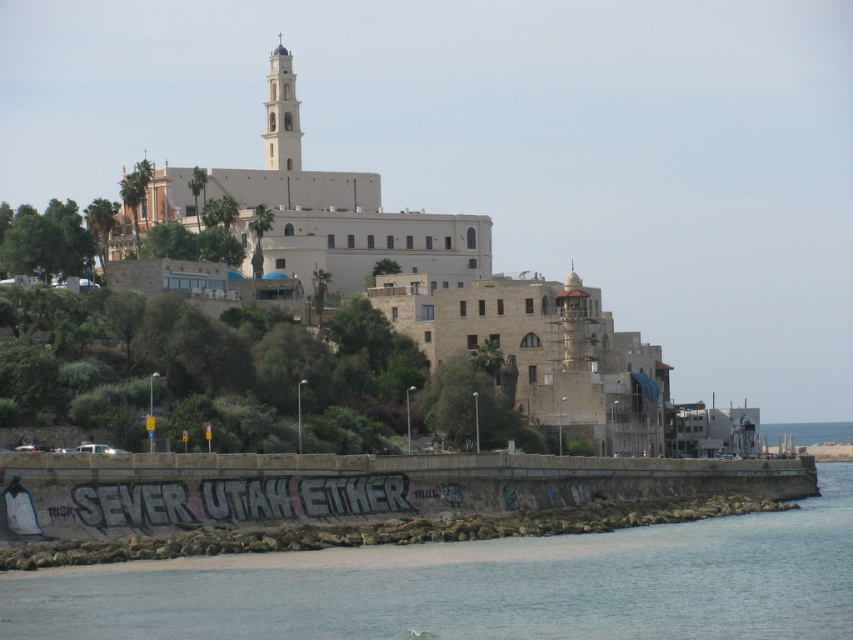
Can you confirm if white stone tower at upper center is bigger than blue water at lower right?

Actually, white stone tower at upper center might be smaller than blue water at lower right.

Does white stone tower at upper center have a smaller size compared to blue water at lower right?

Indeed, white stone tower at upper center has a smaller size compared to blue water at lower right.

Which is in front, point (283, 170) or point (798, 432)?

Point (283, 170) is in front.

What are the coordinates of `white stone tower at upper center` in the screenshot? It's located at (281, 113).

Between clear water at lower left and blue water at lower right, which one has less height?

blue water at lower right is shorter.

Is clear water at lower left taller than blue water at lower right?

Yes.

In order to click on clear water at lower left in this screenshot , I will do `click(479, 586)`.

Which is more to the right, clear water at lower left or white stone tower at upper center?

From the viewer's perspective, clear water at lower left appears more on the right side.

Is clear water at lower left positioned behind white stone tower at upper center?

That is False.

The width and height of the screenshot is (853, 640). I want to click on clear water at lower left, so click(x=479, y=586).

This screenshot has height=640, width=853. Identify the location of clear water at lower left. (479, 586).